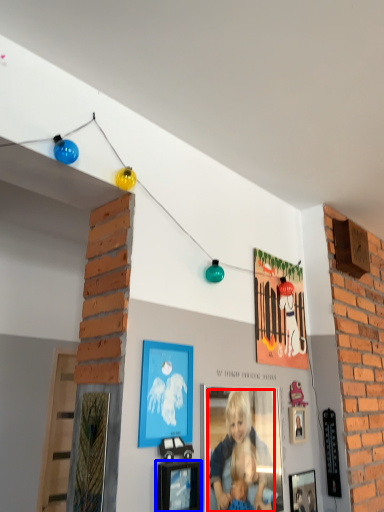
Question: Which object appears farthest to the camera in this image, person (highlighted by a red box) or picture frame (highlighted by a blue box)?

Choices:
 (A) person
 (B) picture frame

Answer: (A)